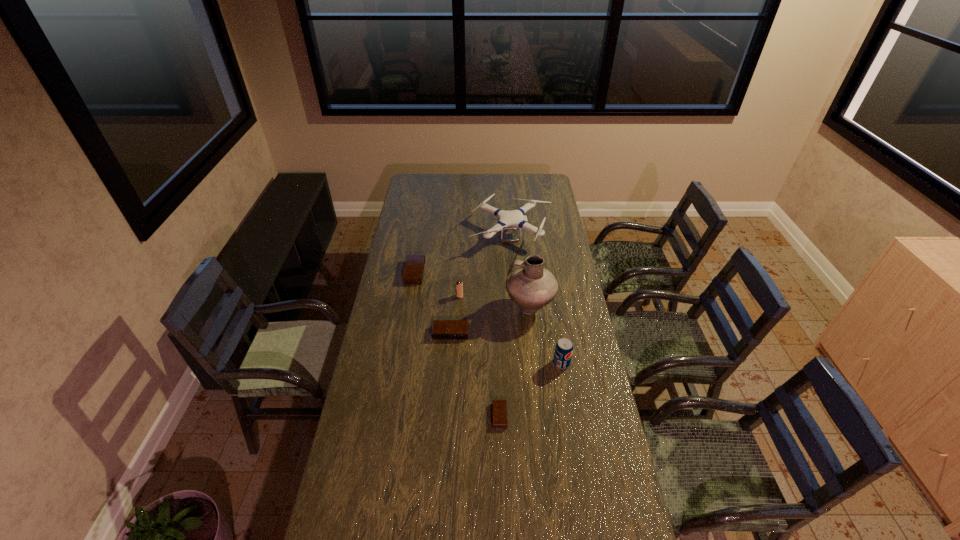
Please point a free position for a alarm clock on the right. Please provide its 2D coordinates. Your answer should be formatted as a tuple, i.e. [(x, y)], where the tuple contains the x and y coordinates of a point satisfying the conditions above.

[(570, 535)]